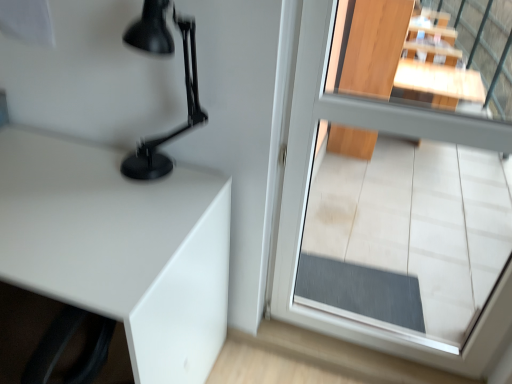
Where is `free spot above white glossy table at left (from a real-world perspective)`? This screenshot has height=384, width=512. free spot above white glossy table at left (from a real-world perspective) is located at coordinates (71, 195).